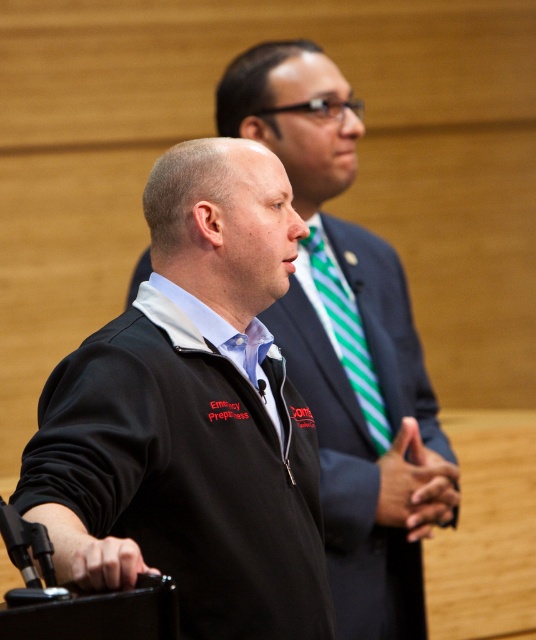
At what (x,y) coordinates should I click in order to perform the action: click on black fleece jacket at center. Please return your answer as a coordinate pair (x, y). The image size is (536, 640). Looking at the image, I should click on pos(191,416).

Does black fleece jacket at center have a greater height compared to dark blue suit at center?

No.

Is point (201, 596) more distant than point (404, 292)?

No, (201, 596) is in front of (404, 292).

I want to click on black fleece jacket at center, so click(191, 416).

Measure the distance between black fleece jacket at center and camera.

5.21 feet

Does point (255, 182) lie in front of point (400, 433)?

Yes, point (255, 182) is in front of point (400, 433).

The image size is (536, 640). I want to click on black fleece jacket at center, so click(191, 416).

Is black matte jacket at center to the right of dark blue suit at center from the viewer's perspective?

Incorrect, black matte jacket at center is not on the right side of dark blue suit at center.

Can you confirm if black matte jacket at center is taller than dark blue suit at center?

Yes.

Does point (287, 116) lie in front of point (386, 387)?

That is False.

Identify the location of black matte jacket at center. (348, 346).